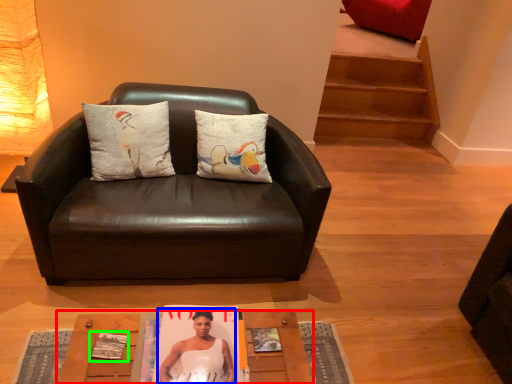
Question: Estimate the real-world distances between objects in this image. Which object is closer to table (highlighted by a red box), person (highlighted by a blue box) or magazine (highlighted by a green box)?

Choices:
 (A) person
 (B) magazine

Answer: (A)